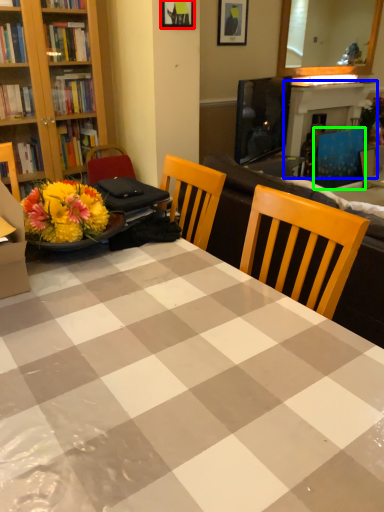
Question: Estimate the real-world distances between objects in this image. Which object is closer to picture frame (highlighted by a red box), fireplace (highlighted by a blue box) or armchair (highlighted by a green box)?

Choices:
 (A) fireplace
 (B) armchair

Answer: (A)